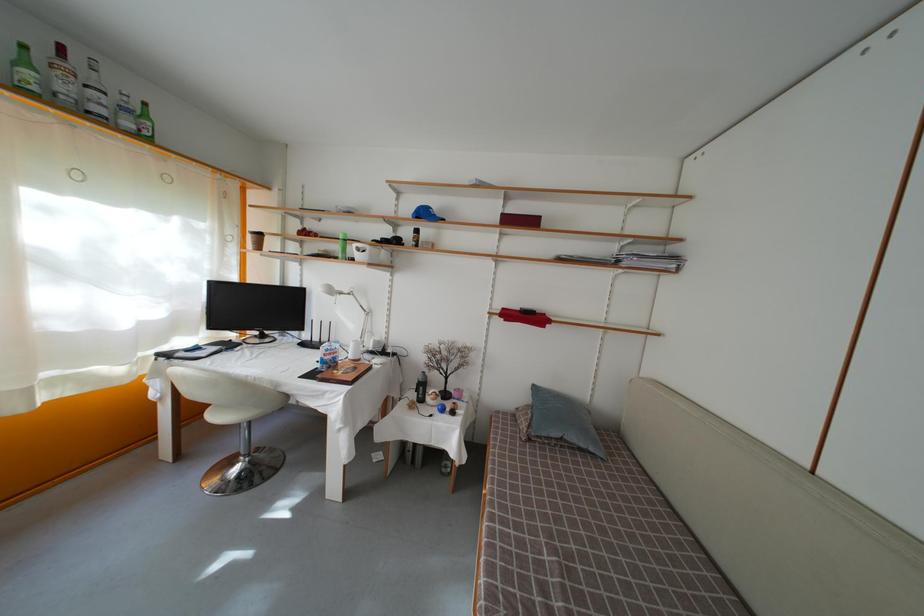
The width and height of the screenshot is (924, 616). I want to click on white liquor bottle, so click(93, 92).